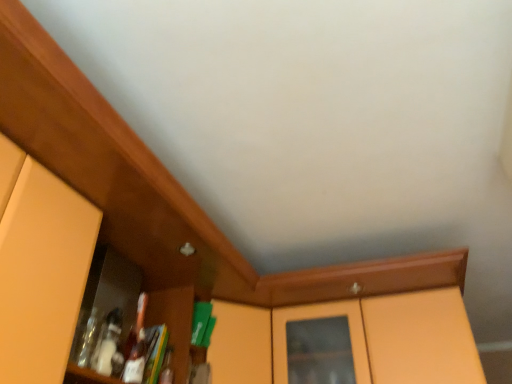
Measure the distance between point (410, 275) and camera.

The depth of point (410, 275) is 5.39 feet.

You are a GUI agent. You are given a task and a screenshot of the screen. Output one action in this format:
    pyautogui.click(x=<x>, y=<y>)
    Task: Click on the matte orange cabinet at left
    This screenshot has width=512, height=384.
    Given the screenshot: What is the action you would take?
    pyautogui.click(x=40, y=264)

Locate an element on the screen. matte orange cabinet at center is located at coordinates (355, 321).

Is matte orange cabinet at center positioned with its back to matte orange cabinet at left?

No, matte orange cabinet at center is not facing the opposite direction of matte orange cabinet at left.

Between matte orange cabinet at center and matte orange cabinet at left, which one has smaller size?

With smaller size is matte orange cabinet at left.

Locate an element on the screen. cabinetry that appears on the right of matte orange cabinet at left is located at coordinates (355, 321).

Looking at this image, is matte orange cabinet at center not inside matte orange cabinet at left?

Yes, matte orange cabinet at center is located beyond the bounds of matte orange cabinet at left.

Between matte orange cabinet at left and matte orange cabinet at center, which one has larger width?

matte orange cabinet at center is wider.

From the image's perspective, is matte orange cabinet at left located above or below matte orange cabinet at center?

Based on their image positions, matte orange cabinet at left is located above matte orange cabinet at center.

Are matte orange cabinet at left and matte orange cabinet at center making contact?

No, matte orange cabinet at left is not making contact with matte orange cabinet at center.

Does matte orange cabinet at left have a lesser height compared to matte orange cabinet at center?

Incorrect, the height of matte orange cabinet at left does not fall short of that of matte orange cabinet at center.

Measure the distance from matte orange cabinet at left to matte orange cabinet at left.

The distance of matte orange cabinet at left from matte orange cabinet at left is 0.23 inches.

From a real-world perspective, is matte orange cabinet at left located higher than matte orange cabinet at left?

No.

What's the angular difference between matte orange cabinet at left and matte orange cabinet at left's facing directions?

The facing directions of matte orange cabinet at left and matte orange cabinet at left are 2.67e-05 degrees apart.

Is the depth of matte orange cabinet at left less than that of matte orange cabinet at left?

Yes, it is.

From a real-world perspective, is matte orange cabinet at left physically above matte orange cabinet at center?

No, from a real-world perspective, matte orange cabinet at left is not over matte orange cabinet at center

From the image's perspective, which object appears higher, matte orange cabinet at left or matte orange cabinet at center?

matte orange cabinet at left.

Considering the relative sizes of matte orange cabinet at left and matte orange cabinet at center in the image provided, is matte orange cabinet at left thinner than matte orange cabinet at center?

Indeed, matte orange cabinet at left has a lesser width compared to matte orange cabinet at center.

Is matte orange cabinet at left next to matte orange cabinet at left?

Yes, matte orange cabinet at left is with matte orange cabinet at left.

Does matte orange cabinet at left have a lesser height compared to matte orange cabinet at left?

Yes, matte orange cabinet at left is shorter than matte orange cabinet at left.

Looking at their sizes, would you say matte orange cabinet at left is wider or thinner than matte orange cabinet at left?

Clearly, matte orange cabinet at left has more width compared to matte orange cabinet at left.

From a real-world perspective, is matte orange cabinet at center on matte orange cabinet at left?

Yes, from a real-world perspective, matte orange cabinet at center is on top of matte orange cabinet at left.

Consider the image. Between matte orange cabinet at center and matte orange cabinet at left, which one appears on the right side from the viewer's perspective?

Positioned to the right is matte orange cabinet at center.

Looking at this image, is matte orange cabinet at center turned away from matte orange cabinet at left?

matte orange cabinet at center is not turned away from matte orange cabinet at left.

Between matte orange cabinet at center and matte orange cabinet at left, which one has larger size?

Bigger between the two is matte orange cabinet at center.

I want to click on cabinetry that is on the right side of matte orange cabinet at left, so click(x=355, y=321).

Identify the location of cabinetry behind the matte orange cabinet at left. (355, 321).

Based on their spatial positions, is matte orange cabinet at left or matte orange cabinet at left closer to matte orange cabinet at center?

matte orange cabinet at left.

Which object lies further to the anchor point matte orange cabinet at left, matte orange cabinet at left or matte orange cabinet at center?

Based on the image, matte orange cabinet at center appears to be further to matte orange cabinet at left.

In the scene shown: Based on their spatial positions, is matte orange cabinet at left or matte orange cabinet at left closer to matte orange cabinet at center?

matte orange cabinet at left is positioned closer to the anchor matte orange cabinet at center.

Considering their positions, is matte orange cabinet at left positioned closer to matte orange cabinet at left than matte orange cabinet at center?

matte orange cabinet at left is closer to matte orange cabinet at left.

When comparing their distances from matte orange cabinet at left, does matte orange cabinet at center or matte orange cabinet at left seem closer?

matte orange cabinet at left is closer to matte orange cabinet at left.

Estimate the real-world distances between objects in this image. Which object is further from matte orange cabinet at left, matte orange cabinet at center or matte orange cabinet at left?

The object further to matte orange cabinet at left is matte orange cabinet at center.

I want to click on dresser between matte orange cabinet at left and matte orange cabinet at center, so click(x=40, y=264).